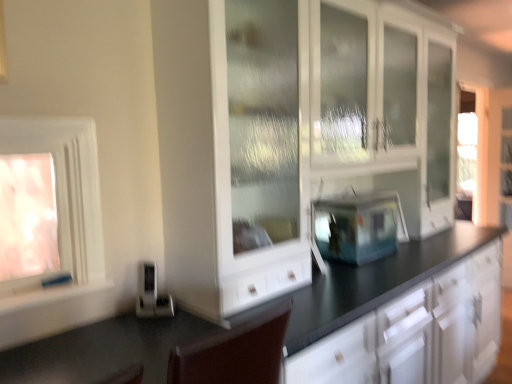
Find the location of a particular element. free spot above white glossy window at left, placed as the 2th window when sorted from left to right (from a real-world perspective) is located at coordinates (39, 120).